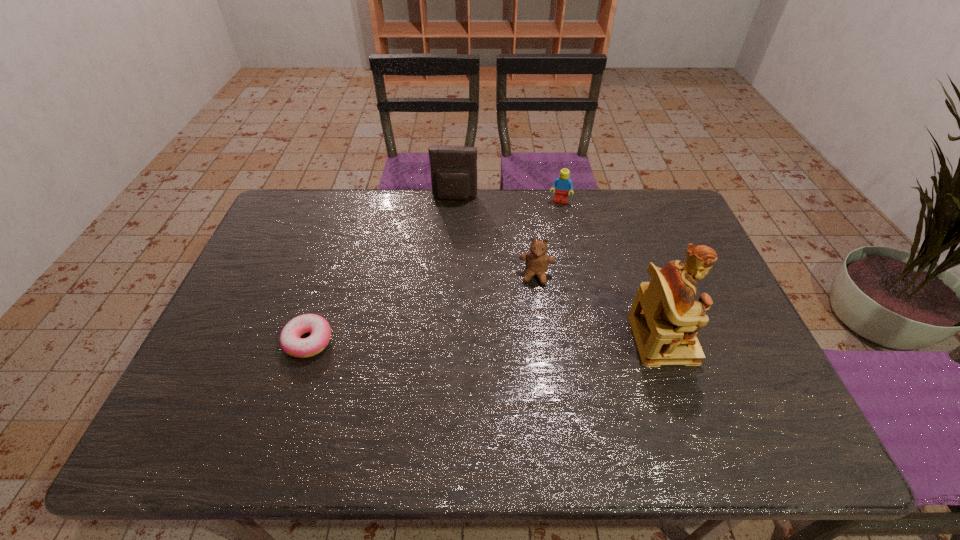
Image resolution: width=960 pixels, height=540 pixels. In order to click on vacant area situated on the front-facing side of the tallest object in this screenshot , I will do click(748, 339).

This screenshot has height=540, width=960. What are the coordinates of `vacant space located on the face of the third farthest object` in the screenshot? It's located at (525, 366).

I want to click on vacant space located on the face of the third farthest object, so [524, 372].

Where is `free space located on the face of the third farthest object`? The width and height of the screenshot is (960, 540). free space located on the face of the third farthest object is located at coordinates (524, 372).

The height and width of the screenshot is (540, 960). I want to click on free space located with an open flap on the fourth shortest object, so click(450, 223).

This screenshot has height=540, width=960. What are the coordinates of `free space located 0.370m with an open flap on the fourth shortest object` in the screenshot? It's located at (443, 279).

Where is `vacant space located 0.070m with an open flap on the fourth shortest object`? This screenshot has height=540, width=960. vacant space located 0.070m with an open flap on the fourth shortest object is located at coordinates (451, 215).

Image resolution: width=960 pixels, height=540 pixels. I want to click on vacant space situated 0.400m on the face of the fourth object from left to right, so click(541, 287).

Locate an element on the screen. The width and height of the screenshot is (960, 540). free spot located on the face of the fourth object from left to right is located at coordinates (548, 253).

Locate an element on the screen. The image size is (960, 540). free region located 0.290m on the face of the fourth object from left to right is located at coordinates (546, 261).